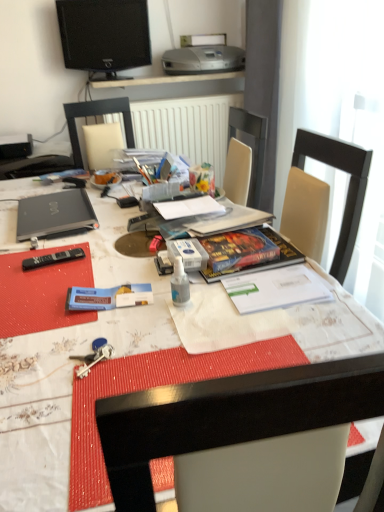
Locate an element on the screen. The width and height of the screenshot is (384, 512). free location above black matte laptop at left (from a real-world perspective) is located at coordinates (63, 212).